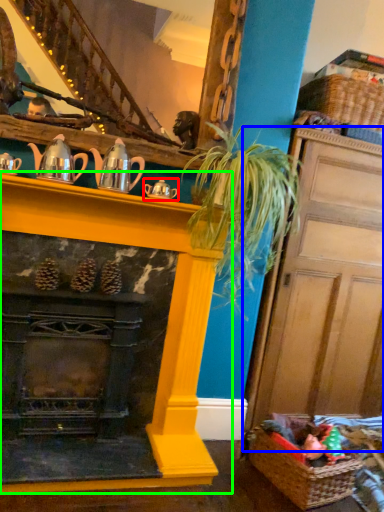
Question: Based on their relative distances, which object is farther from tea pot (highlighted by a red box)? Choose from door (highlighted by a blue box) and fireplace (highlighted by a green box).

Choices:
 (A) door
 (B) fireplace

Answer: (A)